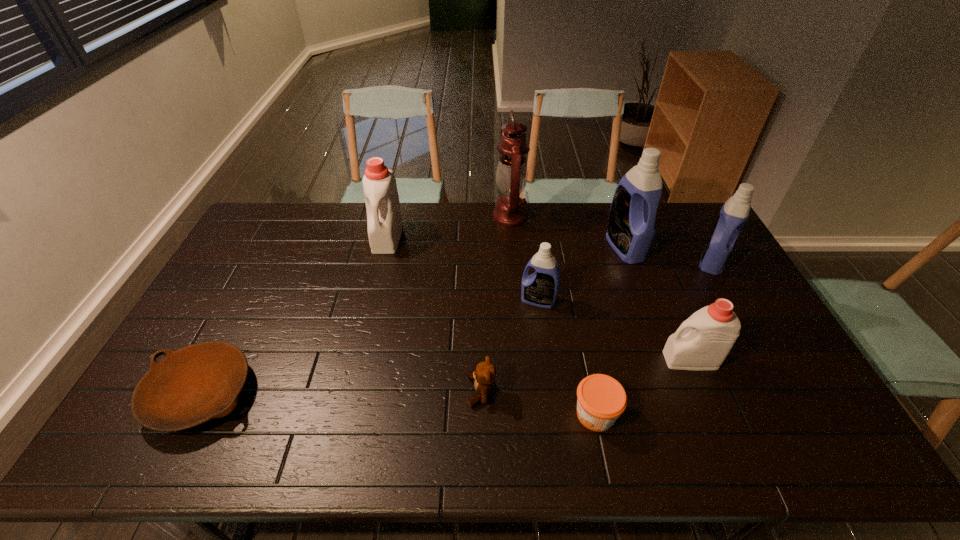
The image size is (960, 540). Identify the location of vacant space located on the front of the second nearest detergent. (544, 344).

This screenshot has width=960, height=540. What are the coordinates of `free space located on the handle side of the smaller white detergent` in the screenshot? It's located at click(x=610, y=360).

Where is `vacant area situated on the handle side of the smaller white detergent`? vacant area situated on the handle side of the smaller white detergent is located at coordinates (606, 360).

Find the location of a particular element. The image size is (960, 540). vacant space located 0.370m on the handle side of the smaller white detergent is located at coordinates (529, 360).

Identify the location of vacant space located 0.220m on the front-facing side of the brown teddy bear. (383, 392).

The width and height of the screenshot is (960, 540). In order to click on vacant space located on the front-facing side of the brown teddy bear in this screenshot , I will do `click(437, 392)`.

At what (x,y) coordinates should I click in order to perform the action: click on free space located 0.230m on the front-facing side of the brown teddy bear. Please return your answer as a coordinate pair (x, y). The width and height of the screenshot is (960, 540). Looking at the image, I should click on (379, 392).

Find the location of `vacant space situated on the front label of the jam`. vacant space situated on the front label of the jam is located at coordinates pyautogui.click(x=436, y=414).

I want to click on vacant area situated 0.250m on the front label of the jam, so click(x=471, y=414).

Find the location of a particular element. The width and height of the screenshot is (960, 540). vacant area located on the front label of the jam is located at coordinates (544, 414).